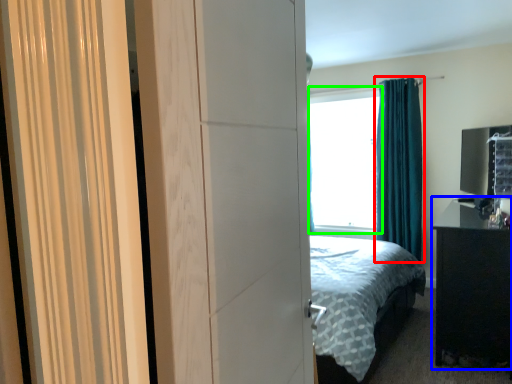
Question: Which object is the closest to the curtain (highlighted by a red box)? Choose among these: nightstand (highlighted by a blue box) or window screen (highlighted by a green box).

Choices:
 (A) nightstand
 (B) window screen

Answer: (B)